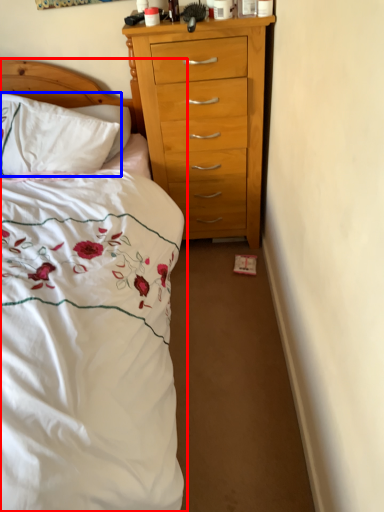
Question: Among these objects, which one is nearest to the camera, bed (highlighted by a red box) or pillow (highlighted by a blue box)?

Choices:
 (A) bed
 (B) pillow

Answer: (A)